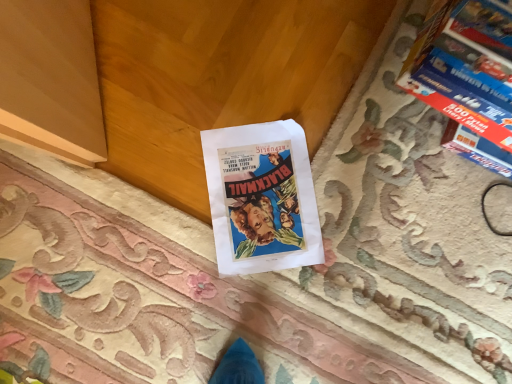
Identify the location of free space behind vintage paper poster at center. (335, 119).